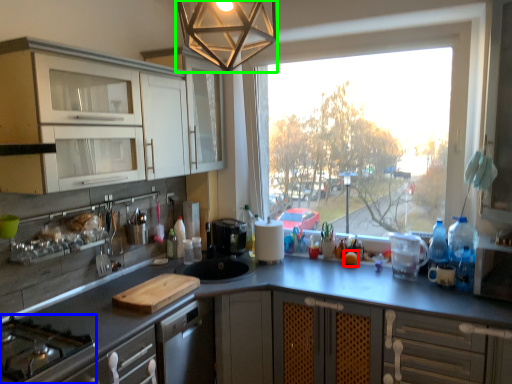
Question: Estimate the real-world distances between objects in this image. Which object is farther from orange (highlighted by a red box), gas stove (highlighted by a blue box) or light fixture (highlighted by a green box)?

Choices:
 (A) gas stove
 (B) light fixture

Answer: (A)